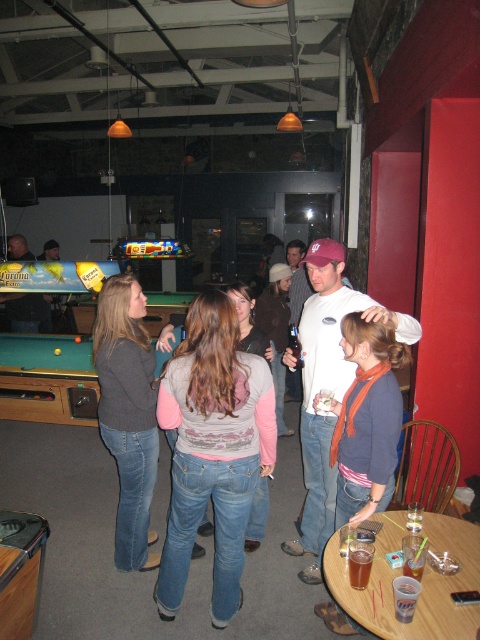
Question: Which object is farther from the camera taking this photo?

Choices:
 (A) green felt pool table at left
 (B) translucent plastic cup at table center

Answer: (A)

Question: Is green felt pool table at lower left to the left of matte black pool table at left from the viewer's perspective?

Choices:
 (A) yes
 (B) no

Answer: (B)

Question: Which point is farther to the camera?

Choices:
 (A) green felt pool table at lower left
 (B) green felt pool table at left
 (C) translucent plastic cup at center

Answer: (B)

Question: Which of these objects is positioned farthest from the green felt pool table at lower left?

Choices:
 (A) translucent plastic cup at center
 (B) white cotton t-shirt at center
 (C) translucent plastic cup at table center

Answer: (A)

Question: Is green felt pool table at left further to camera compared to matte black pool table at left?

Choices:
 (A) yes
 (B) no

Answer: (A)

Question: Can you confirm if matte black pool table at left is positioned to the left of translucent plastic cup at center?

Choices:
 (A) no
 (B) yes

Answer: (B)